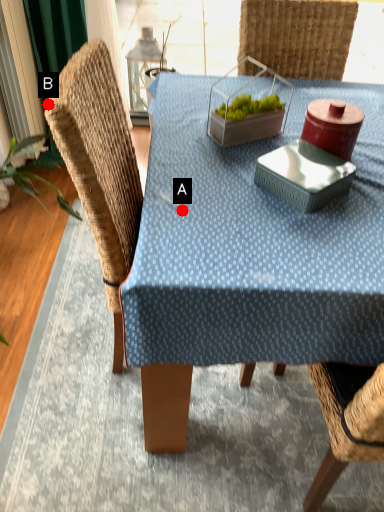
Question: Two points are circled on the image, labeled by A and B beside each circle. Which point is farther from the camera taking this photo?

Choices:
 (A) A is further
 (B) B is further

Answer: (A)